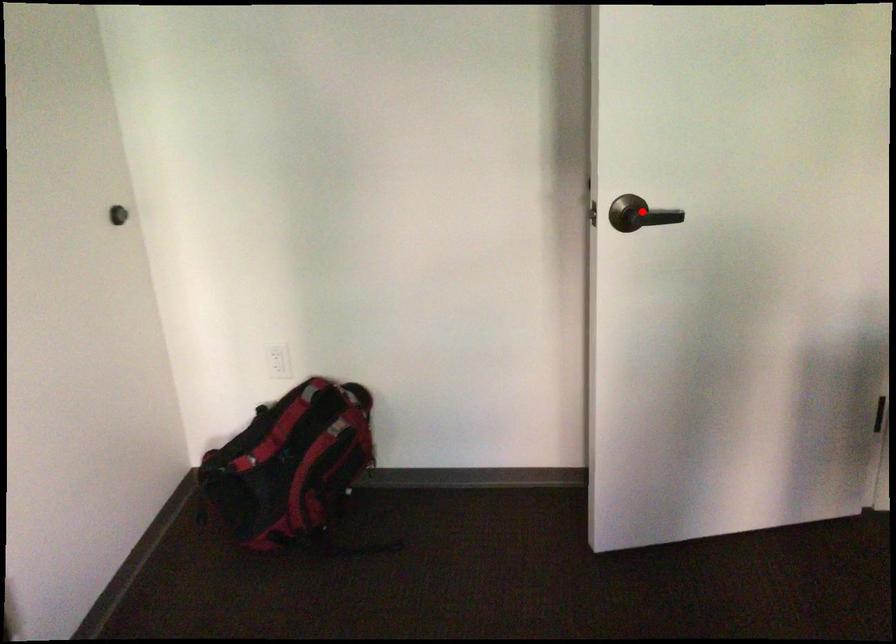
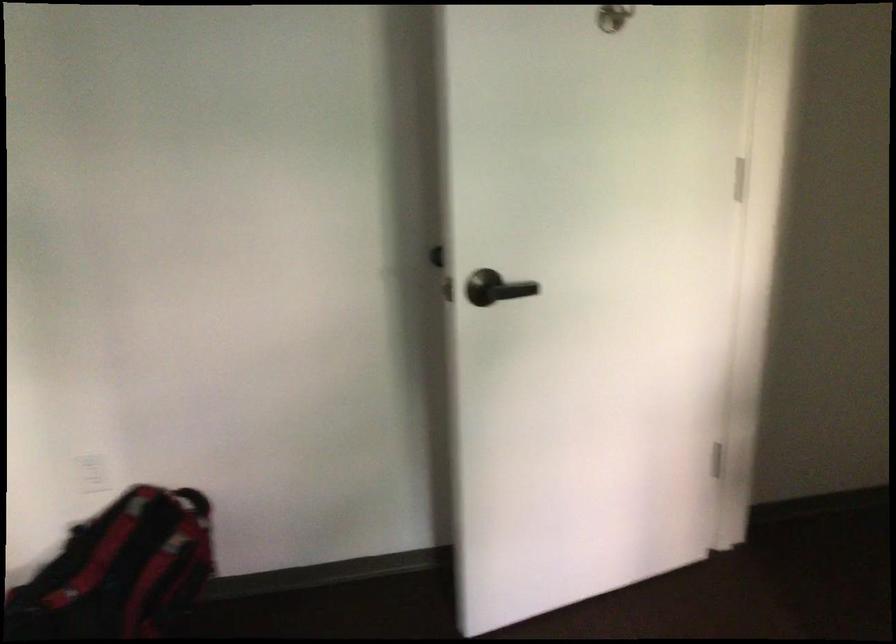
In the second image, find the point that corresponds to the highlighted location in the first image.

(495, 288)